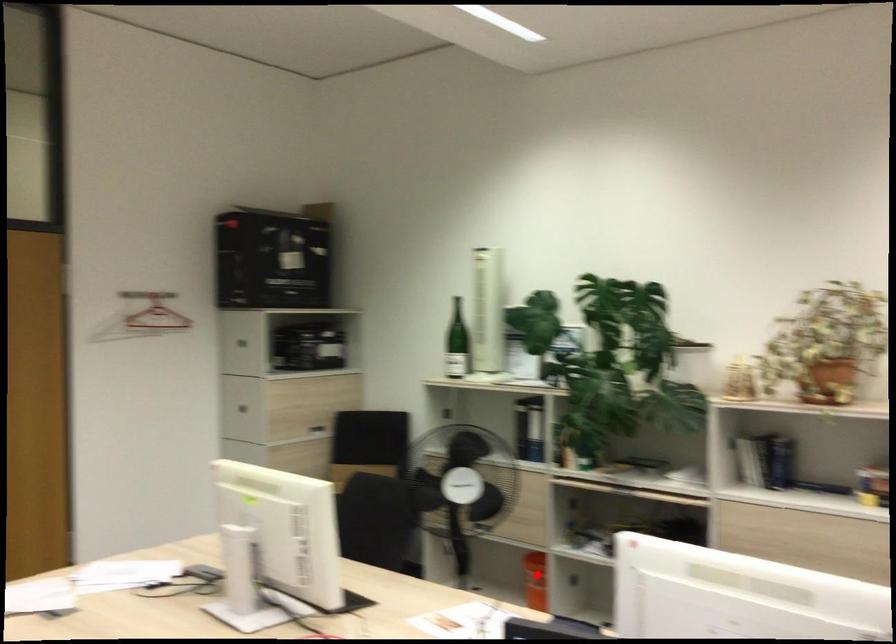
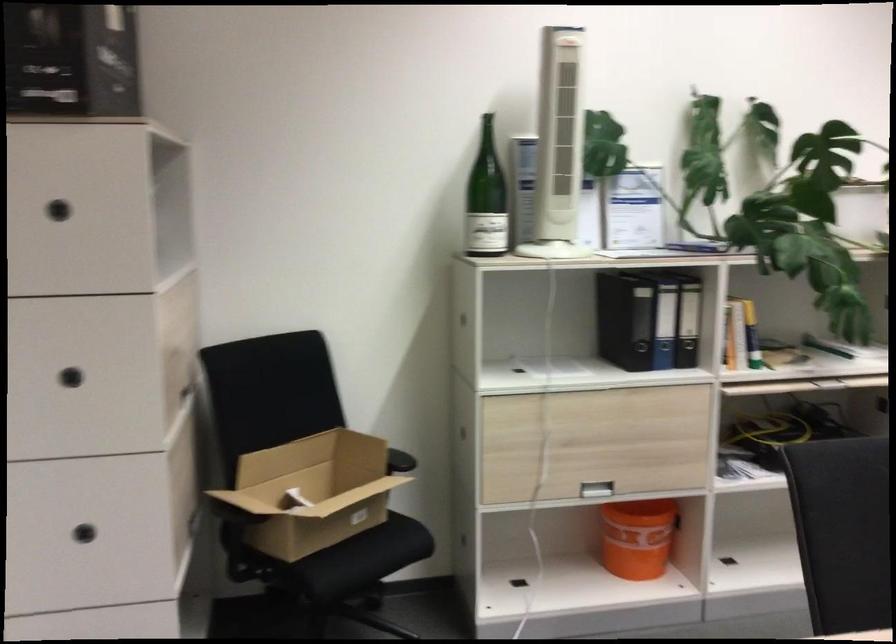
The point at the highlighted location is marked in the first image. Where is the corresponding point in the second image?

(636, 538)